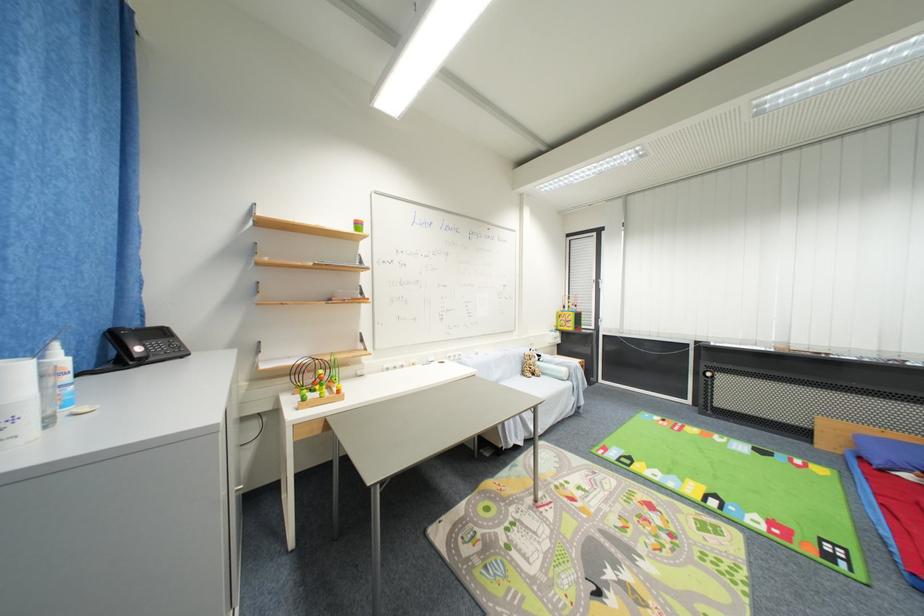
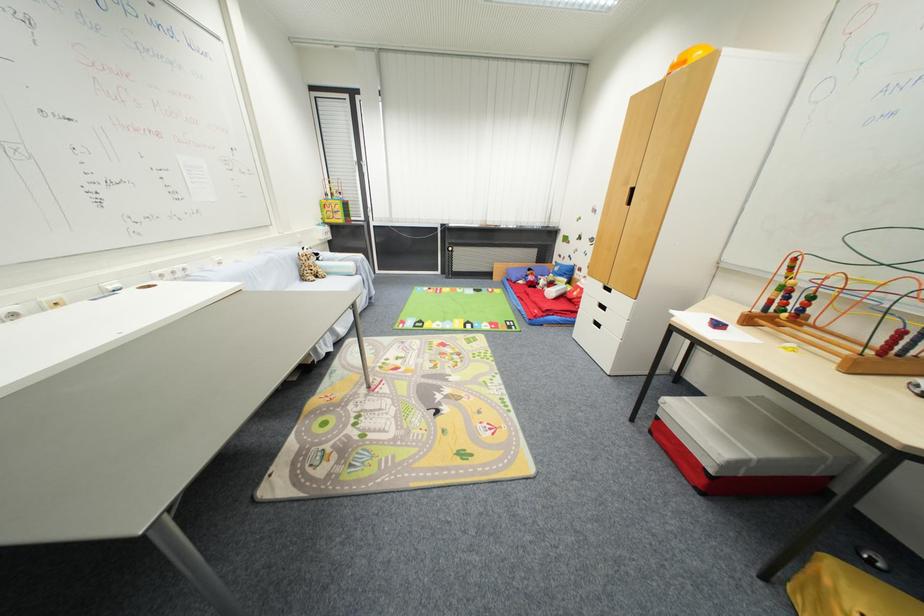
Where in the second image is the point corresponding to point (618, 484) from the first image?

(423, 342)